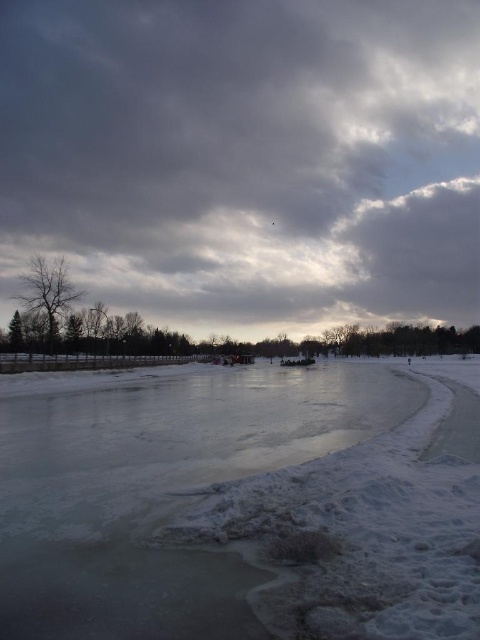
Between gray cloudy sky at upper center and white ice at center, which one appears on the right side from the viewer's perspective?

white ice at center

Based on the photo, who is more distant from viewer, [274,122] or [33,429]?

The point [274,122] is more distant.

The width and height of the screenshot is (480, 640). Identify the location of gray cloudy sky at upper center. click(244, 160).